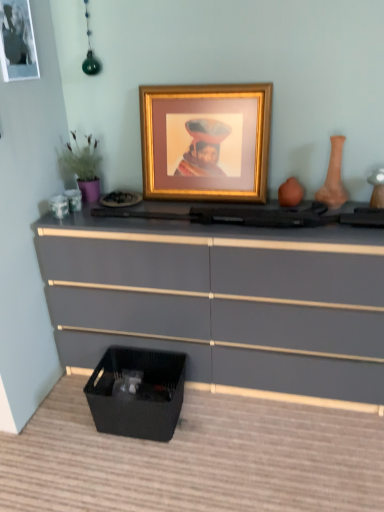
Describe the element at coordinates (17, 41) in the screenshot. I see `metallic gold picture frame at upper left, the 1th picture frame positioned from the left` at that location.

This screenshot has height=512, width=384. Identify the location of black woven basket at lower left. (137, 392).

What do you see at coordinates (137, 392) in the screenshot? This screenshot has width=384, height=512. I see `black woven basket at lower left` at bounding box center [137, 392].

I want to click on terracotta clay vase at right, so click(x=333, y=176).

Where is `gold metallic picture frame at center, acting as the 1th picture frame starting from the right`? Image resolution: width=384 pixels, height=512 pixels. gold metallic picture frame at center, acting as the 1th picture frame starting from the right is located at coordinates (205, 141).

Locate an element on the screen. The height and width of the screenshot is (512, 384). metallic gold picture frame at upper left, the 1th picture frame positioned from the left is located at coordinates (17, 41).

Is terracotta clay vase at right located outside green matte plant at left?

terracotta clay vase at right is positioned outside green matte plant at left.

Is terracotta clay vase at right positioned far away from green matte plant at left?

Yes, terracotta clay vase at right and green matte plant at left are located far from each other.

Between terracotta clay vase at right and green matte plant at left, which one has more height?

green matte plant at left is taller.

The width and height of the screenshot is (384, 512). I want to click on houseplant located above the terracotta clay vase at right (from a real-world perspective), so click(82, 167).

Which object is positioned more to the left, metallic gold picture frame at upper left, the 1th picture frame positioned from the left, or terracotta clay vase at right?

metallic gold picture frame at upper left, the 1th picture frame positioned from the left.

In the scene shown: Looking at their sizes, would you say metallic gold picture frame at upper left, which ranks as the 2th picture frame in right-to-left order, is wider or thinner than terracotta clay vase at right?

In the image, metallic gold picture frame at upper left, which ranks as the 2th picture frame in right-to-left order, appears to be more narrow than terracotta clay vase at right.

Which is correct: metallic gold picture frame at upper left, which ranks as the 2th picture frame in right-to-left order, is inside terracotta clay vase at right, or outside of it?

metallic gold picture frame at upper left, which ranks as the 2th picture frame in right-to-left order, is spatially situated outside terracotta clay vase at right.

From a real-world perspective, is metallic gold picture frame at upper left, which ranks as the 2th picture frame in right-to-left order, physically below terracotta clay vase at right?

No.

Considering the relative sizes of green matte plant at left and gold metallic picture frame at center, acting as the 1th picture frame starting from the right, in the image provided, is green matte plant at left wider than gold metallic picture frame at center, acting as the 1th picture frame starting from the right,?

Yes.

In the image, is green matte plant at left positioned in front of or behind gold metallic picture frame at center, acting as the 1th picture frame starting from the right?

green matte plant at left is positioned farther from the viewer than gold metallic picture frame at center, acting as the 1th picture frame starting from the right.

Between green matte plant at left and gold metallic picture frame at center, marked as the 2th picture frame in a left-to-right arrangement, which one appears on the right side from the viewer's perspective?

gold metallic picture frame at center, marked as the 2th picture frame in a left-to-right arrangement, is more to the right.

You are a GUI agent. You are given a task and a screenshot of the screen. Output one action in this format:
    pyautogui.click(x=<x>, y=<y>)
    Task: Click on the houseplant located behind the gold metallic picture frame at center, marked as the 2th picture frame in a left-to-right arrangement
    This screenshot has height=512, width=384.
    Given the screenshot: What is the action you would take?
    pyautogui.click(x=82, y=167)

Can you tell me how much green matte plant at left and metallic gold picture frame at upper left, which ranks as the 2th picture frame in right-to-left order, differ in facing direction?

88.8 degrees separate the facing orientations of green matte plant at left and metallic gold picture frame at upper left, which ranks as the 2th picture frame in right-to-left order.

Are green matte plant at left and metallic gold picture frame at upper left, which ranks as the 2th picture frame in right-to-left order, located far from each other?

No, green matte plant at left is in close proximity to metallic gold picture frame at upper left, which ranks as the 2th picture frame in right-to-left order.

Is point (90, 152) closer or farther from the camera than point (25, 32)?

Point (90, 152) is farther from the camera than point (25, 32).

Find the location of a particular element. This screenshot has height=512, width=384. picture frame located behind the matte gray chest of drawers at lower center is located at coordinates (205, 141).

From a real-world perspective, which object rests below the other?

From a 3D spatial view, matte gray chest of drawers at lower center is below.

Considering the sizes of matte gray chest of drawers at lower center and gold metallic picture frame at center, marked as the 2th picture frame in a left-to-right arrangement, in the image, is matte gray chest of drawers at lower center bigger or smaller than gold metallic picture frame at center, marked as the 2th picture frame in a left-to-right arrangement,?

matte gray chest of drawers at lower center is bigger than gold metallic picture frame at center, marked as the 2th picture frame in a left-to-right arrangement.

At what (x,y) coordinates should I click in order to perform the action: click on picture frame on the left of gold metallic picture frame at center, acting as the 1th picture frame starting from the right. Please return your answer as a coordinate pair (x, y). The height and width of the screenshot is (512, 384). Looking at the image, I should click on (17, 41).

Is gold metallic picture frame at center, marked as the 2th picture frame in a left-to-right arrangement, facing away from metallic gold picture frame at upper left, the 1th picture frame positioned from the left?

No.

From a real-world perspective, is gold metallic picture frame at center, acting as the 1th picture frame starting from the right, below metallic gold picture frame at upper left, the 1th picture frame positioned from the left?

Yes, from a real-world perspective, gold metallic picture frame at center, acting as the 1th picture frame starting from the right, is under metallic gold picture frame at upper left, the 1th picture frame positioned from the left.

Which object is thinner, gold metallic picture frame at center, acting as the 1th picture frame starting from the right, or metallic gold picture frame at upper left, which ranks as the 2th picture frame in right-to-left order?

metallic gold picture frame at upper left, which ranks as the 2th picture frame in right-to-left order, is thinner.

From a real-world perspective, which is physically below, metallic gold picture frame at upper left, the 1th picture frame positioned from the left, or green matte plant at left?

green matte plant at left.

Considering the relative sizes of metallic gold picture frame at upper left, the 1th picture frame positioned from the left, and green matte plant at left in the image provided, is metallic gold picture frame at upper left, the 1th picture frame positioned from the left, taller than green matte plant at left?

Correct, metallic gold picture frame at upper left, the 1th picture frame positioned from the left, is much taller as green matte plant at left.

Who is bigger, metallic gold picture frame at upper left, the 1th picture frame positioned from the left, or green matte plant at left?

Bigger between the two is green matte plant at left.

Which object is positioned more to the right, metallic gold picture frame at upper left, which ranks as the 2th picture frame in right-to-left order, or green matte plant at left?

Positioned to the right is green matte plant at left.

This screenshot has height=512, width=384. I want to click on vase below the green matte plant at left (from the image's perspective), so pyautogui.click(x=333, y=176).

The image size is (384, 512). I want to click on vase below the metallic gold picture frame at upper left, which ranks as the 2th picture frame in right-to-left order (from a real-world perspective), so click(x=333, y=176).

Looking at the image, which one is located further to matte gray chest of drawers at lower center, green matte plant at left or gold metallic picture frame at center, marked as the 2th picture frame in a left-to-right arrangement?

green matte plant at left is positioned further to the anchor matte gray chest of drawers at lower center.

From the image, which object appears to be nearer to green matte plant at left, gold metallic picture frame at center, marked as the 2th picture frame in a left-to-right arrangement, or metallic gold picture frame at upper left, the 1th picture frame positioned from the left?

The object closer to green matte plant at left is metallic gold picture frame at upper left, the 1th picture frame positioned from the left.

Estimate the real-world distances between objects in this image. Which object is closer to black woven basket at lower left, green matte plant at left or terracotta clay vase at right?

green matte plant at left.

Estimate the real-world distances between objects in this image. Which object is closer to gold metallic picture frame at center, acting as the 1th picture frame starting from the right, green matte plant at left or metallic gold picture frame at upper left, the 1th picture frame positioned from the left?

green matte plant at left is positioned closer to the anchor gold metallic picture frame at center, acting as the 1th picture frame starting from the right.

Looking at the image, which one is located further to black woven basket at lower left, gold metallic picture frame at center, marked as the 2th picture frame in a left-to-right arrangement, or matte gray chest of drawers at lower center?

gold metallic picture frame at center, marked as the 2th picture frame in a left-to-right arrangement.

Based on their spatial positions, is metallic gold picture frame at upper left, which ranks as the 2th picture frame in right-to-left order, or matte gray chest of drawers at lower center further from green matte plant at left?

matte gray chest of drawers at lower center.

From the image, which object appears to be nearer to gold metallic picture frame at center, marked as the 2th picture frame in a left-to-right arrangement, terracotta clay vase at right or metallic gold picture frame at upper left, which ranks as the 2th picture frame in right-to-left order?

terracotta clay vase at right lies closer to gold metallic picture frame at center, marked as the 2th picture frame in a left-to-right arrangement, than the other object.

Looking at the image, which one is located closer to matte gray chest of drawers at lower center, gold metallic picture frame at center, marked as the 2th picture frame in a left-to-right arrangement, or green matte plant at left?

gold metallic picture frame at center, marked as the 2th picture frame in a left-to-right arrangement, lies closer to matte gray chest of drawers at lower center than the other object.

The height and width of the screenshot is (512, 384). I want to click on vase between metallic gold picture frame at upper left, the 1th picture frame positioned from the left, and black woven basket at lower left, in the vertical direction, so click(333, 176).

This screenshot has height=512, width=384. What are the coordinates of `the chest of drawers that lies between metallic gold picture frame at upper left, the 1th picture frame positioned from the left, and black woven basket at lower left from top to bottom` in the screenshot? It's located at (223, 301).

Identify the location of houseplant between metallic gold picture frame at upper left, which ranks as the 2th picture frame in right-to-left order, and gold metallic picture frame at center, marked as the 2th picture frame in a left-to-right arrangement. [x=82, y=167].

Find the location of a particular element. Image resolution: width=384 pixels, height=512 pixels. the chest of drawers between gold metallic picture frame at center, acting as the 1th picture frame starting from the right, and black woven basket at lower left vertically is located at coordinates (x=223, y=301).